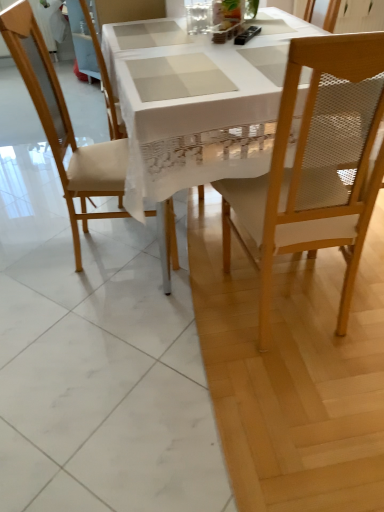
You are a GUI agent. You are given a task and a screenshot of the screen. Output one action in this format:
    pyautogui.click(x=<x>, y=<y>)
    Task: Click on the free space in front of black plastic remote control at upper center
    This screenshot has width=384, height=512.
    Given the screenshot: What is the action you would take?
    pyautogui.click(x=253, y=46)